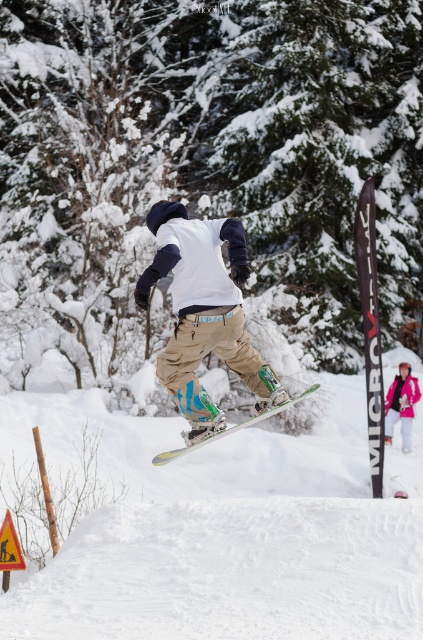
Question: Does matte khaki pants at center have a smaller size compared to pink fabric jacket at lower right?

Choices:
 (A) yes
 (B) no

Answer: (B)

Question: Considering the relative positions of green leafy tree at center and matte khaki pants at center in the image provided, where is green leafy tree at center located with respect to matte khaki pants at center?

Choices:
 (A) right
 (B) left

Answer: (A)

Question: Does green leafy tree at center appear on the right side of white fluffy snow at center?

Choices:
 (A) yes
 (B) no

Answer: (A)

Question: Which object is the closest to the matte khaki pants at center?

Choices:
 (A) pink fabric jacket at lower right
 (B) shiny metallic snowboard at center

Answer: (B)

Question: Which of the following is the closest to the observer?

Choices:
 (A) shiny metallic snowboard at center
 (B) green leafy tree at center

Answer: (A)

Question: Which point is farther from the camera taking this photo?

Choices:
 (A) tap(203, 228)
 (B) tap(397, 17)

Answer: (B)